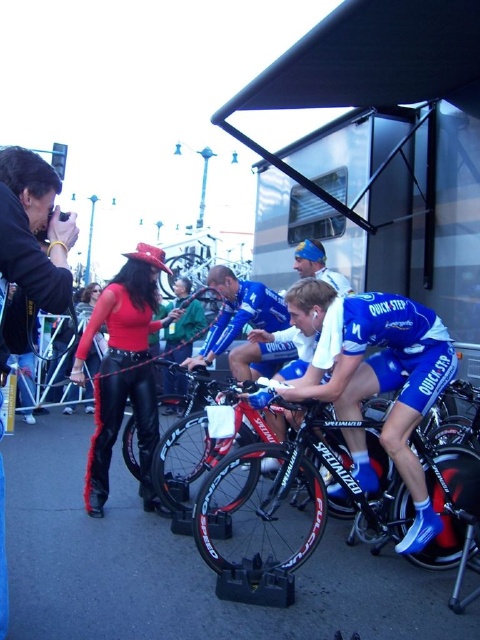
In the scene shown: Between blue matte bicycle at center and leather pants at center, which one appears on the right side from the viewer's perspective?

blue matte bicycle at center is more to the right.

Who is lower down, blue matte bicycle at center or leather pants at center?

blue matte bicycle at center

Is point (348, 352) less distant than point (98, 458)?

Yes.

Where is `blue matte bicycle at center`? blue matte bicycle at center is located at coordinates (374, 372).

Which is above, leather pants at center or black leather jacket at left?

black leather jacket at left

Is leather pants at center further to camera compared to black leather jacket at left?

Yes, leather pants at center is behind black leather jacket at left.

Is point (135, 358) in front of point (50, 166)?

No.

In order to click on leather pants at center in this screenshot , I will do `click(123, 371)`.

Which is behind, point (326, 397) or point (217, 346)?

The point (217, 346) is behind.

Does blue matte bicycle at center appear on the left side of blue jersey at center?

No, blue matte bicycle at center is not to the left of blue jersey at center.

Which is in front, point (335, 308) or point (237, 284)?

Point (335, 308)

Locate an element on the screen. The height and width of the screenshot is (640, 480). blue matte bicycle at center is located at coordinates (374, 372).